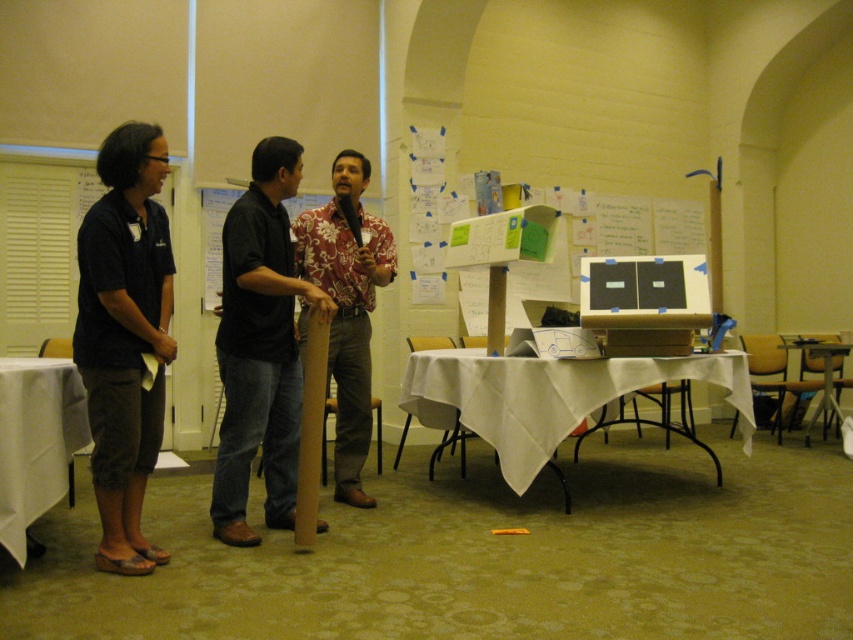
Question: Among these objects, which one is farthest from the camera?

Choices:
 (A) black shirt at center
 (B) white fabric-covered table at center
 (C) white cloth-covered table at center

Answer: (B)

Question: Which of the following is the farthest from the observer?

Choices:
 (A) (26, 524)
 (B) (529, 477)

Answer: (B)

Question: Does dark blue shirt at left appear over black shirt at center?

Choices:
 (A) yes
 (B) no

Answer: (B)

Question: Is dark blue shirt at left smaller than white cloth-covered table at center?

Choices:
 (A) yes
 (B) no

Answer: (A)

Question: From the image, what is the correct spatial relationship of black shirt at center in relation to white cloth table at left?

Choices:
 (A) right
 (B) left

Answer: (A)

Question: Which of these objects is positioned farthest from the white fabric-covered table at center?

Choices:
 (A) floral shirt at center
 (B) white cloth-covered table at center
 (C) dark blue shirt at left

Answer: (C)